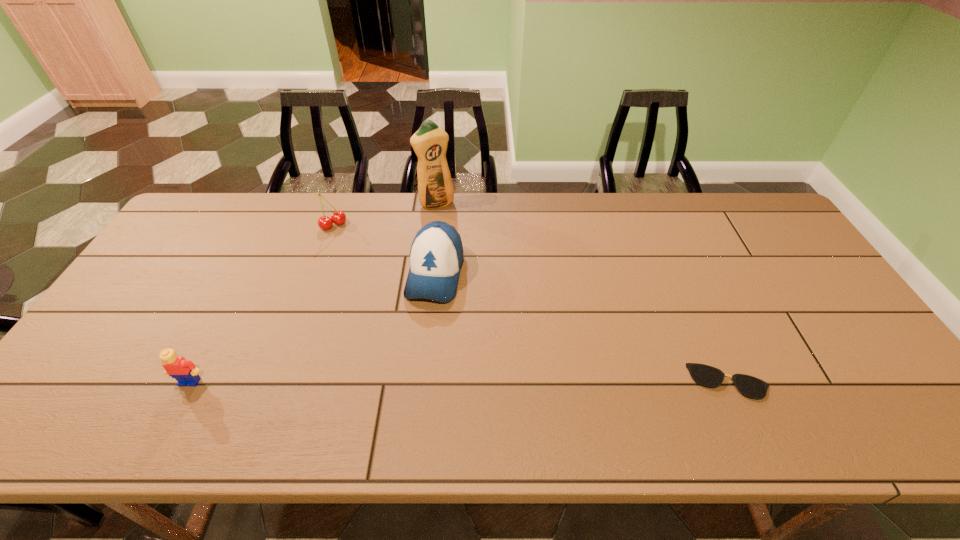
Where is `free location that satisfies the following two spatial constraints: 1. on the face of the rightmost object; 2. on the right side of the leftmost object`? free location that satisfies the following two spatial constraints: 1. on the face of the rightmost object; 2. on the right side of the leftmost object is located at coordinates (190, 382).